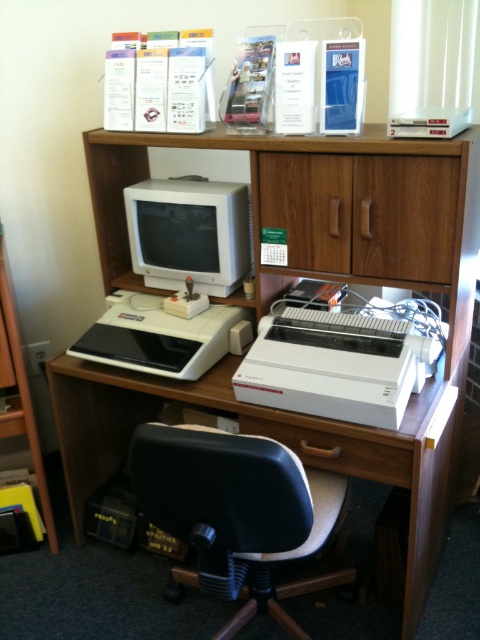
Question: Is matte white monitor at center positioned behind black plastic printer at center?

Choices:
 (A) yes
 (B) no

Answer: (A)

Question: Which of these objects is positioned closest to the wooden drawer at lower center?

Choices:
 (A) black plastic printer at center
 (B) white plastic printer at center

Answer: (B)

Question: Does black plastic printer at center appear on the right side of wooden bookshelf at left?

Choices:
 (A) no
 (B) yes

Answer: (B)

Question: Which point is closer to the camera taking this photo?

Choices:
 (A) (129, 205)
 (B) (16, 433)

Answer: (B)

Question: In this image, where is black leather swivel chair at center located relative to wooden cabinet at center?

Choices:
 (A) above
 (B) below

Answer: (B)

Question: Which point appears closest to the camera in this image?

Choices:
 (A) (19, 392)
 (B) (229, 307)
 (C) (238, 582)

Answer: (C)